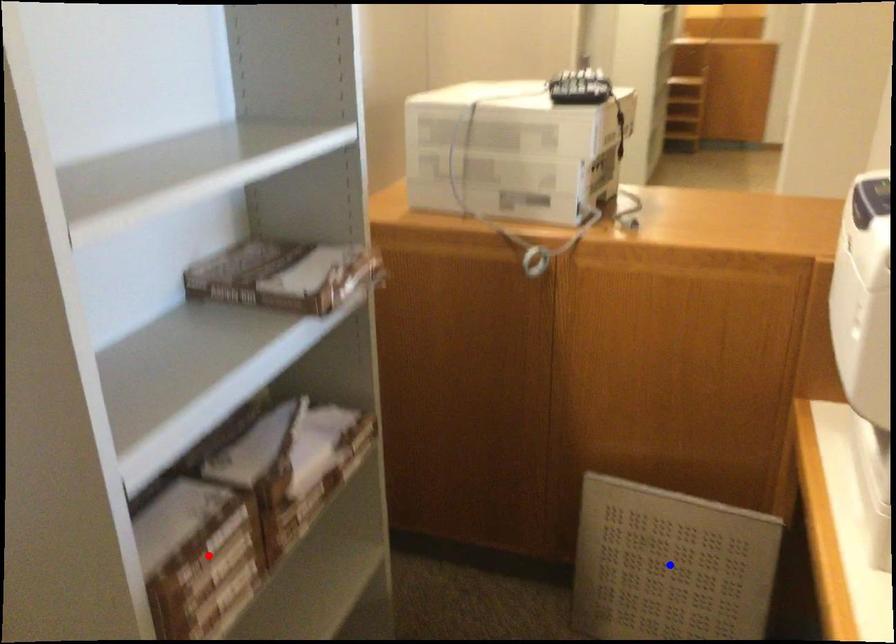
Question: In the image, two points are highlighted. Which point is nearer to the camera? Reply with the corresponding letter.

Choices:
 (A) blue point
 (B) red point

Answer: (B)